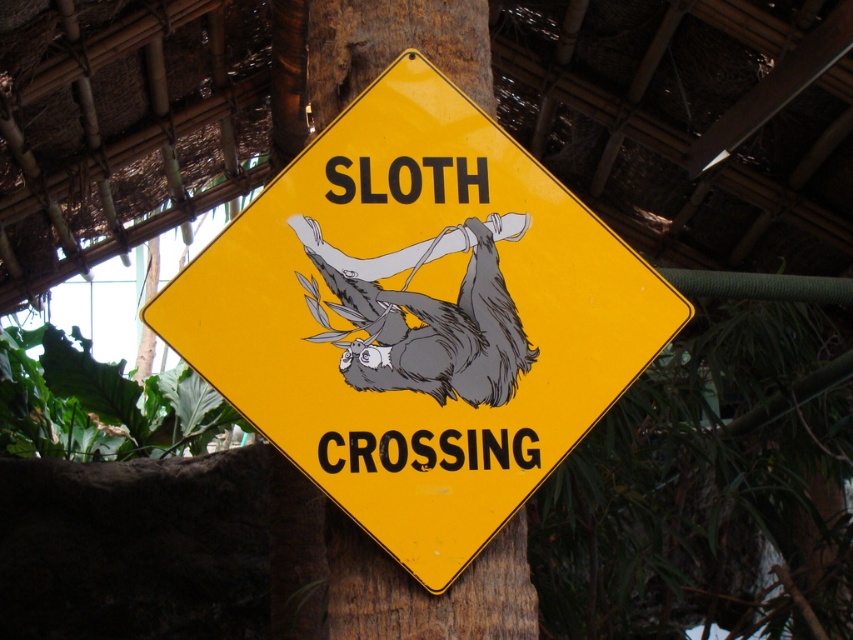
You are a delivery drone that needs to deliver a package to a location marked by the yellow matte sign at center. However, there is a gray matte sloth at center in the way. Given that your drone has a minimum safe distance requirement of 2 inches to avoid collisions, can you safely land at the sign without hitting the sloth?

The yellow matte sign at center is 2.10 inches from the gray matte sloth at center. Since the minimum safe distance required is 2 inches, the drone can safely land at the sign as the distance is sufficient to avoid collision with the sloth.

You are a driver approaching a road with a yellow matte sign at center and a gray matte sloth at center. Which object would you need to look up to see first as you drive towards them?

The yellow matte sign at center is bigger than the gray matte sloth at center, so you would see the yellow matte sign at center first as it is larger and more prominent in your line of sight.

You are driving a car and see the yellow matte sign at center and the gray matte sloth at center. Which object is closer to you?

The yellow matte sign at center is closer to you because it is in front of the gray matte sloth at center.